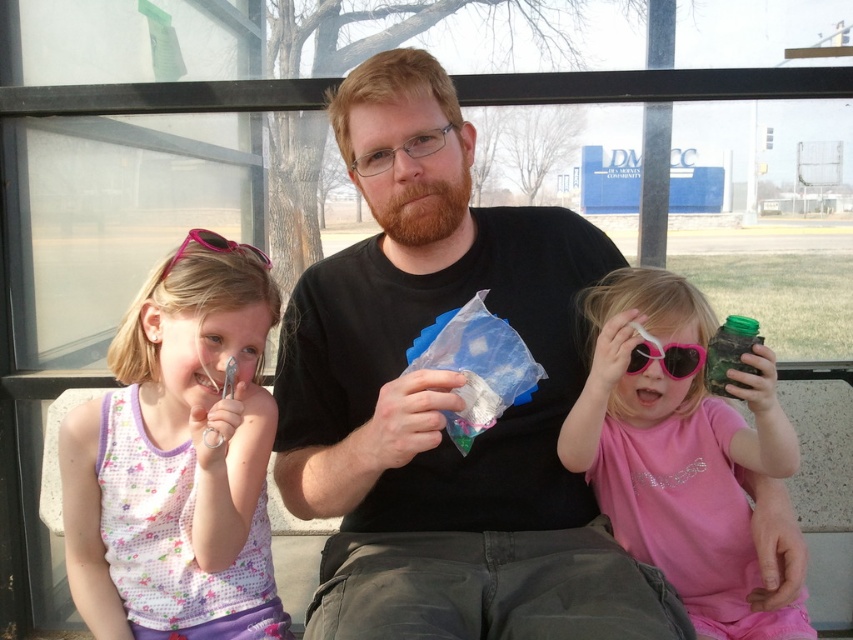
You are a photographer standing at the bus stop and want to take a group photo of the black matte shirt at center and the pink fabric dress at left. Since you want to ensure both subjects are in focus, you need to know which one is taller. Can you tell me which one is taller?

The black matte shirt at center has a greater height compared to the pink fabric dress at left, so the photographer should focus on the taller subject first to ensure both are in focus.

You are a delivery person who needs to place a small package between the pink plastic goggles at center and the pink plastic goggles at upper left. The package is 24 inches long. Will it fit between them?

The distance between the pink plastic goggles at center and the pink plastic goggles at upper left is 24.47 inches. Since the package is 24 inches long, it will fit between them with a small amount of space remaining.

You are a photographer trying to capture a group photo of the black matte shirt at center and the pink fabric dress at left. Since you want the subjects to appear balanced in the frame, which subject should you position closer to the camera to compensate for their size difference?

The pink fabric dress at left should be positioned closer to the camera because the black matte shirt at center is wider. By moving the narrower pink fabric dress at left forward, it will appear larger in the frame, balancing the visual sizes of both subjects.